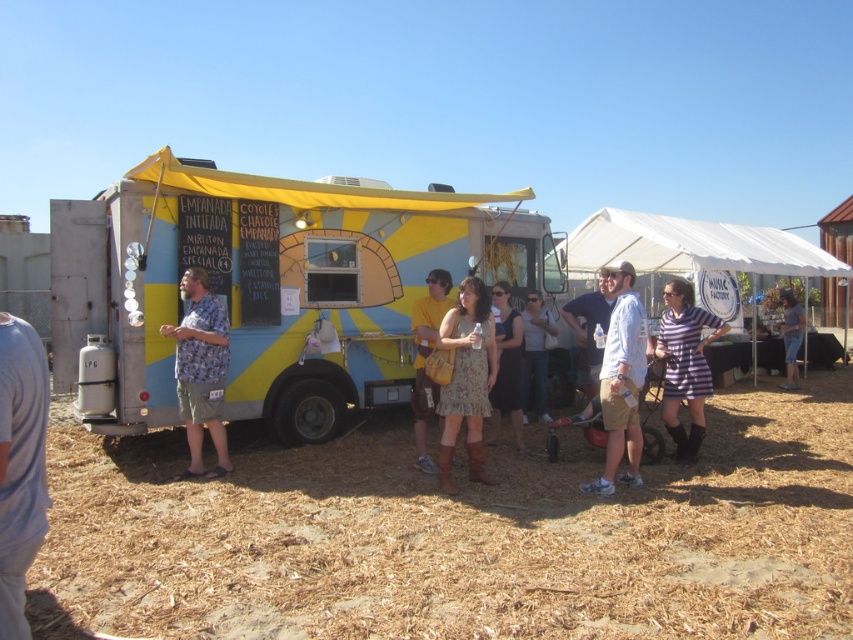
Question: Which point is farther to the camera?

Choices:
 (A) (492, 483)
 (B) (694, 392)

Answer: (B)

Question: Can you confirm if floral dress at center is thinner than matte floral dress at center?

Choices:
 (A) no
 (B) yes

Answer: (A)

Question: Which of these objects is positioned farthest from the matte floral dress at center?

Choices:
 (A) striped fabric dress at center
 (B) brown mulch at lower center
 (C) floral shirt at center

Answer: (A)

Question: Which object is farther from the camera taking this photo?

Choices:
 (A) striped fabric dress at center
 (B) matte yellow dress at center
 (C) white fabric canopy at upper right
 (D) striped cotton dress at center

Answer: (A)

Question: Does white fabric canopy at upper right appear under striped fabric dress at center?

Choices:
 (A) yes
 (B) no

Answer: (B)

Question: Does gray fabric shirt at lower left have a greater width compared to floral dress at center?

Choices:
 (A) yes
 (B) no

Answer: (B)